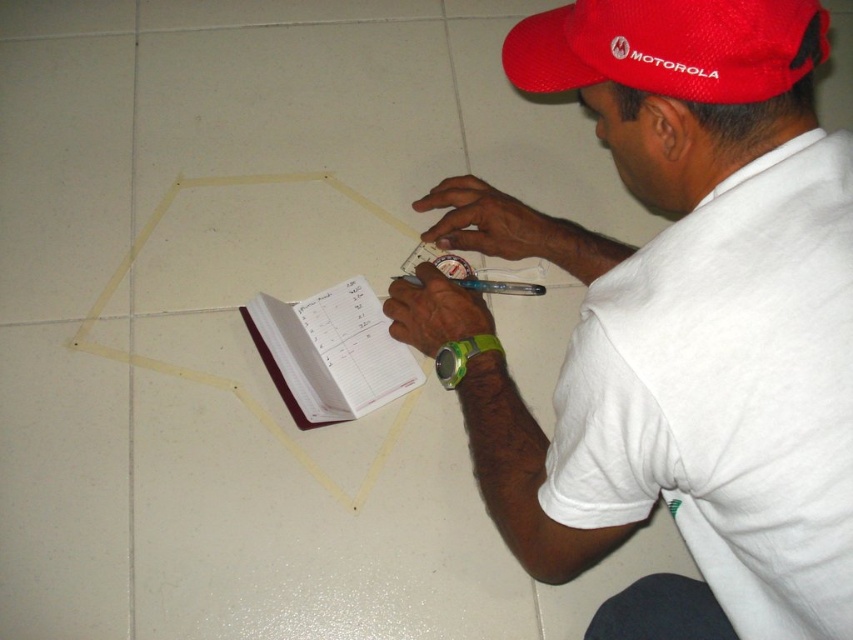
Question: Based on their relative distances, which object is nearer to the green rubber wristband at lower right?

Choices:
 (A) maroon leather notebook at center
 (B) translucent plastic pen at center
 (C) white matte shirt at center
 (D) red mesh cap at upper center

Answer: (B)

Question: Can you confirm if white matte shirt at center is positioned below red mesh cap at upper center?

Choices:
 (A) no
 (B) yes

Answer: (B)

Question: Which of the following is the closest to the observer?

Choices:
 (A) green rubber wristband at lower right
 (B) maroon leather notebook at center

Answer: (A)

Question: Which point is closer to the camera?

Choices:
 (A) (706, 29)
 (B) (374, 374)
 (C) (447, 355)

Answer: (A)

Question: Is maroon leather notebook at center bigger than green rubber wristband at lower right?

Choices:
 (A) yes
 (B) no

Answer: (A)

Question: Can you confirm if white matte shirt at center is positioned below red mesh cap at upper center?

Choices:
 (A) no
 (B) yes

Answer: (B)